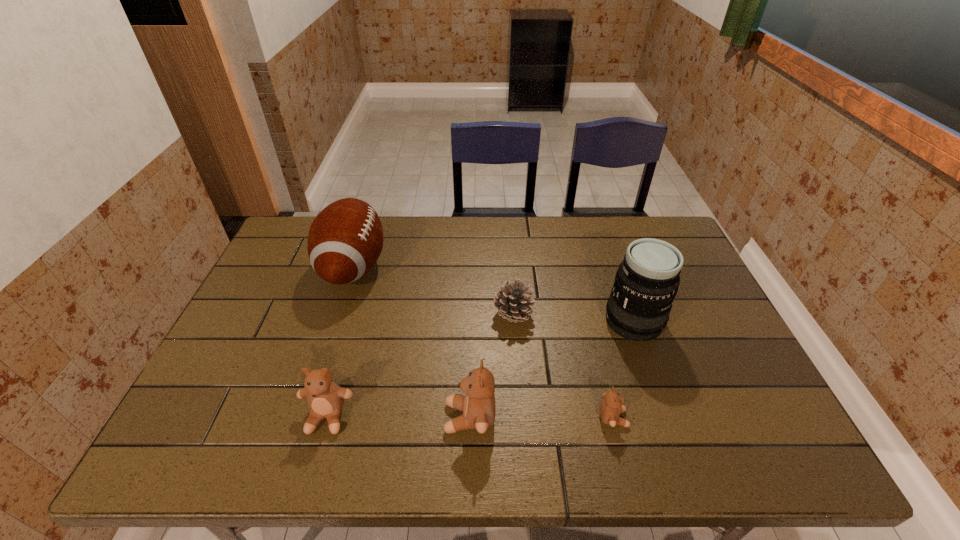
Find the location of `free point located 0.400m on the front-facing side of the third object from left to right`. free point located 0.400m on the front-facing side of the third object from left to right is located at coordinates (269, 417).

I want to click on free space located 0.280m on the front-facing side of the third object from left to right, so (322, 417).

I want to click on vacant space located 0.240m on the front-facing side of the second object from right to left, so click(x=732, y=418).

Image resolution: width=960 pixels, height=540 pixels. In order to click on vacant region located on the laces of the football in this screenshot , I will do `click(444, 267)`.

Where is `free location located on the left of the rightmost object`? This screenshot has height=540, width=960. free location located on the left of the rightmost object is located at coordinates (503, 321).

Image resolution: width=960 pixels, height=540 pixels. I want to click on vacant region located 0.130m on the back of the pinecone, so click(x=510, y=271).

Find the location of a particular element. This screenshot has width=960, height=540. object situated at the far edge is located at coordinates (345, 240).

Locate an element on the screen. This screenshot has width=960, height=540. object present at the left edge is located at coordinates (345, 240).

The height and width of the screenshot is (540, 960). I want to click on object that is at the far left corner, so click(x=345, y=240).

The height and width of the screenshot is (540, 960). In the image, there is a desktop. In order to click on vacant space at the far edge in this screenshot , I will do `click(532, 218)`.